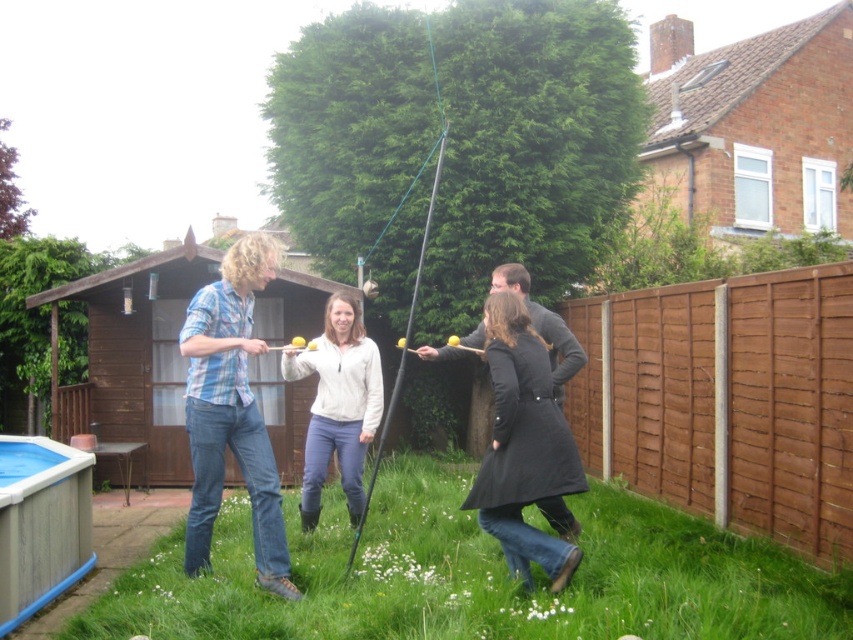
You are a photographer positioned at the edge of the backyard scene. You want to take a photo that includes both the white fleece jacket at center and the dark gray sweater at center. Which of the two should you adjust to ensure both are visible in the frame?

To ensure both the white fleece jacket at center and the dark gray sweater at center are visible in the frame, you should move the dark gray sweater at center forward. Since the dark gray sweater at center is currently behind the white fleece jacket at center, adjusting its position will allow both to be seen.

You are a photographer trying to capture a photo of the white fleece jacket at center and the brown wooden fence at right. Based on their sizes, which object should you focus on first to ensure it fits entirely within the frame?

The brown wooden fence at right is larger in size than the white fleece jacket at center, so you should focus on capturing the brown wooden fence at right first to ensure it fits entirely within the frame.

You are a participant in the game and want to hit the ball so it reaches the brown wooden fence at right. If the ball travels at 2 meters per second, how many seconds will it take for the ball to reach the fence?

The brown wooden fence at right is 4.57 meters away. At a speed of 2 meters per second, the ball will take 2.285 seconds to reach the fence.